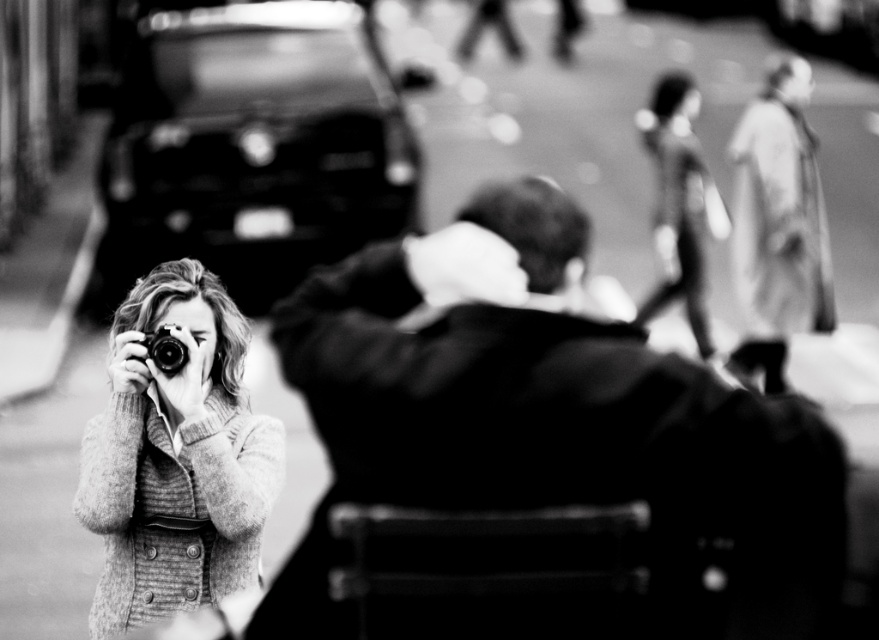
Question: Is the position of smooth leather jacket at center more distant than that of shiny black car at upper left?

Choices:
 (A) no
 (B) yes

Answer: (A)

Question: Does shiny black car at upper left appear on the right side of metallic silver camera at center?

Choices:
 (A) yes
 (B) no

Answer: (B)

Question: Which point is closer to the camera?

Choices:
 (A) (609, 493)
 (B) (120, 513)

Answer: (A)

Question: Among these objects, which one is nearest to the camera?

Choices:
 (A) metallic silver camera at center
 (B) shiny black car at upper left

Answer: (A)

Question: Which of the following is the farthest from the observer?

Choices:
 (A) knitted sweater at left
 (B) metallic silver camera at center
 (C) smooth leather jacket at center

Answer: (B)

Question: Is shiny black car at upper left positioned behind knitted sweater at left?

Choices:
 (A) no
 (B) yes

Answer: (B)